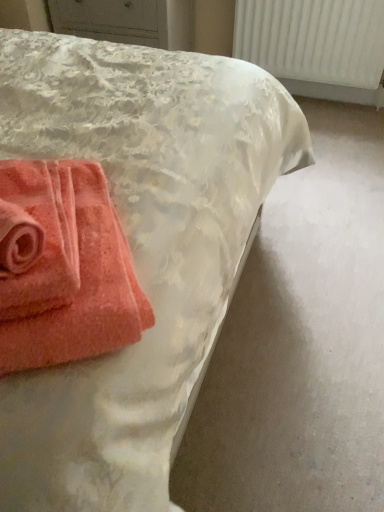
Identify the location of free space above coral terry cloth towel at lower left, marked as the first towel in a right-to-left arrangement (from a real-world perspective). (49, 225).